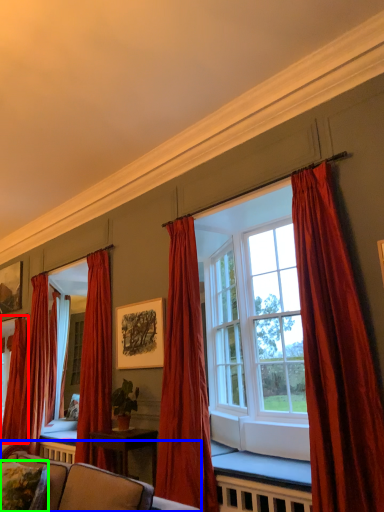
Question: Which object is the closest to the curtain (highlighted by a red box)? Choose among these: studio couch (highlighted by a blue box) or pillow (highlighted by a green box).

Choices:
 (A) studio couch
 (B) pillow

Answer: (A)